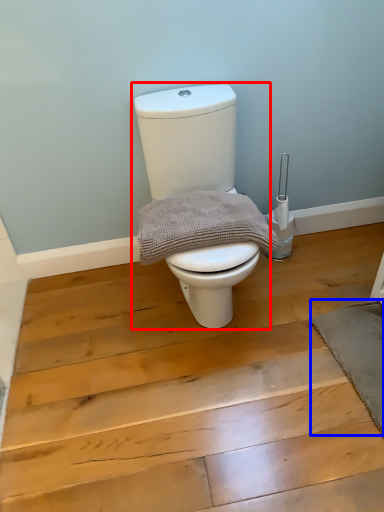
Question: Which of the following is the farthest to the observer, toilet (highlighted by a red box) or bath mat (highlighted by a blue box)?

Choices:
 (A) toilet
 (B) bath mat

Answer: (B)